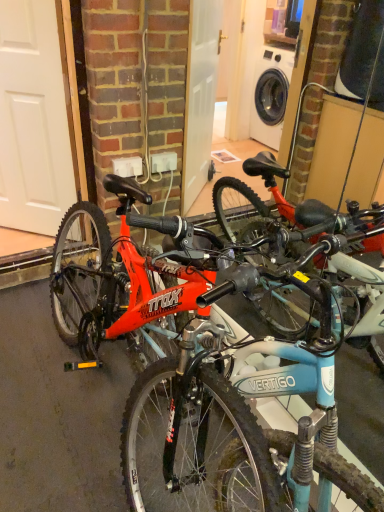
The width and height of the screenshot is (384, 512). What are the coordinates of `white matte door at left` in the screenshot? It's located at pyautogui.click(x=33, y=120).

What is the approximate width of white matte door at left?

6.11 inches.

What do you see at coordinates (33, 120) in the screenshot? I see `white matte door at left` at bounding box center [33, 120].

At what (x,y) coordinates should I click in order to perform the action: click on shiny red bicycle at left. Please return your answer as a coordinate pair (x, y). Looking at the image, I should click on (210, 360).

This screenshot has width=384, height=512. What do you see at coordinates (210, 360) in the screenshot?
I see `shiny red bicycle at left` at bounding box center [210, 360].

This screenshot has width=384, height=512. Identify the location of white matte door at left. (33, 120).

Considering the positions of objects white matte door at left and shiny red bicycle at left in the image provided, who is more to the right, white matte door at left or shiny red bicycle at left?

From the viewer's perspective, shiny red bicycle at left appears more on the right side.

Which object is closer to the camera taking this photo, white matte door at left or shiny red bicycle at left?

Positioned in front is shiny red bicycle at left.

Is point (42, 179) closer or farther from the camera than point (199, 350)?

Clearly, point (42, 179) is more distant from the camera than point (199, 350).

From the image's perspective, is white matte door at left located beneath shiny red bicycle at left?

Actually, white matte door at left appears above shiny red bicycle at left in the image.

From a real-world perspective, which object stands above the other?

white matte door at left, from a real-world perspective.

In terms of width, does white matte door at left look wider or thinner when compared to shiny red bicycle at left?

Clearly, white matte door at left has less width compared to shiny red bicycle at left.

Between white matte door at left and shiny red bicycle at left, which one has less height?

Standing shorter between the two is shiny red bicycle at left.

Who is bigger, white matte door at left or shiny red bicycle at left?

With larger size is shiny red bicycle at left.

Is white matte door at left not within shiny red bicycle at left?

Yes, white matte door at left is located beyond the bounds of shiny red bicycle at left.

Is white matte door at left positioned far away from shiny red bicycle at left?

No, white matte door at left is not far away from shiny red bicycle at left.

Does white matte door at left turn towards shiny red bicycle at left?

No.

Consider the image. Measure the distance between white matte door at left and shiny red bicycle at left.

white matte door at left is 38.63 inches from shiny red bicycle at left.

Find the location of a particular element. The height and width of the screenshot is (512, 384). garage door behind the shiny red bicycle at left is located at coordinates (33, 120).

Which object is positioned more to the left, shiny red bicycle at left or white matte door at left?

white matte door at left is more to the left.

Considering the positions of objects shiny red bicycle at left and white matte door at left in the image provided, who is behind, shiny red bicycle at left or white matte door at left?

white matte door at left is behind.

Is point (328, 437) farther from viewer compared to point (14, 168)?

No, (328, 437) is in front of (14, 168).

In the scene shown: From the image's perspective, which one is positioned higher, shiny red bicycle at left or white matte door at left?

white matte door at left appears higher in the image.

From a real-world perspective, is shiny red bicycle at left under white matte door at left?

Yes, from a real-world perspective, shiny red bicycle at left is beneath white matte door at left.

Is shiny red bicycle at left thinner than white matte door at left?

Incorrect, the width of shiny red bicycle at left is not less than that of white matte door at left.

From their relative heights in the image, would you say shiny red bicycle at left is taller or shorter than white matte door at left?

Clearly, shiny red bicycle at left is shorter compared to white matte door at left.

Which of these two, shiny red bicycle at left or white matte door at left, is bigger?

Bigger between the two is shiny red bicycle at left.

Is shiny red bicycle at left positioned beyond the bounds of white matte door at left?

That's correct, shiny red bicycle at left is outside of white matte door at left.

Would you say shiny red bicycle at left is a long distance from white matte door at left?

No, there isn't a large distance between shiny red bicycle at left and white matte door at left.

Is shiny red bicycle at left aimed at white matte door at left?

No, shiny red bicycle at left is not oriented towards white matte door at left.

Where is `garage door that is on the left side of shiny red bicycle at left`? The height and width of the screenshot is (512, 384). garage door that is on the left side of shiny red bicycle at left is located at coordinates (33, 120).

Identify the location of garage door behind the shiny red bicycle at left. (33, 120).

What are the coordinates of `garage door on the left side of shiny red bicycle at left` in the screenshot? It's located at (33, 120).